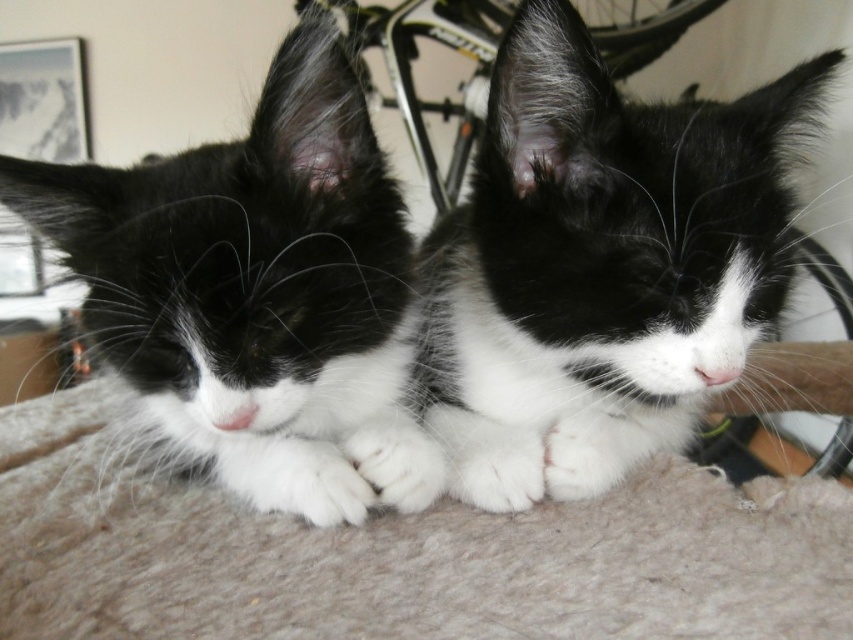
Question: Does black and white fur at center lie behind black soft fur cat at center?

Choices:
 (A) no
 (B) yes

Answer: (B)

Question: Which point is farther to the camera?

Choices:
 (A) black and white fur at center
 (B) black soft fur cat at center

Answer: (A)

Question: Is black and white fur at center positioned at the back of black soft fur cat at center?

Choices:
 (A) no
 (B) yes

Answer: (B)

Question: Which point is farther to the camera?

Choices:
 (A) (682, 285)
 (B) (184, 156)

Answer: (B)

Question: In this image, where is black and white fur at center located relative to black soft fur cat at center?

Choices:
 (A) below
 (B) above

Answer: (B)